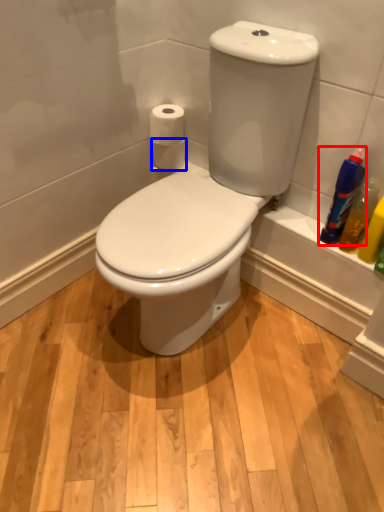
Question: Which object appears farthest to the camera in this image, cleaning product (highlighted by a red box) or toilet paper (highlighted by a blue box)?

Choices:
 (A) cleaning product
 (B) toilet paper

Answer: (B)